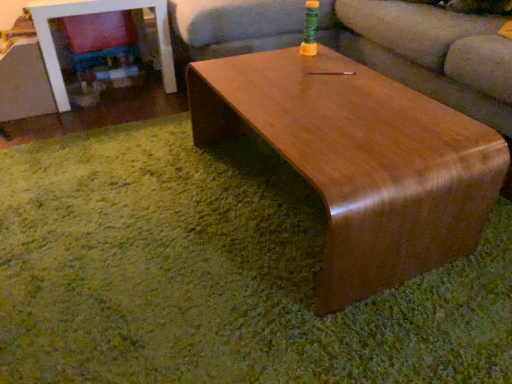
Locate an element on the screen. The width and height of the screenshot is (512, 384). shiny brown wood coffee table at center is located at coordinates (360, 161).

What are the coordinates of `glossy wood table at center` in the screenshot? It's located at 92,13.

Where is `matte brown couch at center`? This screenshot has height=384, width=512. matte brown couch at center is located at coordinates (426, 53).

Is matte brown couch at center spatially inside glossy wood table at center, or outside of it?

matte brown couch at center is spatially situated outside glossy wood table at center.

How different are the orientations of matte brown couch at center and glossy wood table at center in degrees?

The angle between the facing direction of matte brown couch at center and the facing direction of glossy wood table at center is 88.3 degrees.

Does matte brown couch at center appear on the left side of glossy wood table at center?

In fact, matte brown couch at center is to the right of glossy wood table at center.

Is point (340, 48) less distant than point (52, 70)?

No.

How many degrees apart are the facing directions of glossy wood table at center and matte brown couch at center?

There is a 88.3-degree angle between the facing directions of glossy wood table at center and matte brown couch at center.

Is glossy wood table at center touching matte brown couch at center?

No, glossy wood table at center is not making contact with matte brown couch at center.

Is glossy wood table at center completely or partially outside of matte brown couch at center?

glossy wood table at center is positioned outside matte brown couch at center.

Could you tell me if glossy wood table at center is facing matte brown couch at center?

No, glossy wood table at center is not aimed at matte brown couch at center.

Which object is positioned more to the left, glossy wood table at center or shiny brown wood coffee table at center?

From the viewer's perspective, glossy wood table at center appears more on the left side.

Is glossy wood table at center closer to the viewer compared to shiny brown wood coffee table at center?

No, it is behind shiny brown wood coffee table at center.

In the scene shown: From a real-world perspective, is glossy wood table at center physically above shiny brown wood coffee table at center?

Yes, from a real-world perspective, glossy wood table at center is over shiny brown wood coffee table at center

Is glossy wood table at center thinner than shiny brown wood coffee table at center?

In fact, glossy wood table at center might be wider than shiny brown wood coffee table at center.

Is the position of shiny brown wood coffee table at center more distant than that of glossy wood table at center?

No, shiny brown wood coffee table at center is closer to the camera.

Who is bigger, shiny brown wood coffee table at center or glossy wood table at center?

shiny brown wood coffee table at center is bigger.

Between shiny brown wood coffee table at center and glossy wood table at center, which one appears on the left side from the viewer's perspective?

glossy wood table at center.

Is matte brown couch at center surrounding shiny brown wood coffee table at center?

No, shiny brown wood coffee table at center is not inside matte brown couch at center.

From the picture: From the image's perspective, is matte brown couch at center above or below shiny brown wood coffee table at center?

matte brown couch at center is above shiny brown wood coffee table at center.

Where is `coffee table in front of the matte brown couch at center`? This screenshot has height=384, width=512. coffee table in front of the matte brown couch at center is located at coordinates (360, 161).

Who is bigger, matte brown couch at center or shiny brown wood coffee table at center?

Bigger between the two is matte brown couch at center.

Is shiny brown wood coffee table at center to the left or to the right of matte brown couch at center in the image?

In the image, shiny brown wood coffee table at center appears on the left side of matte brown couch at center.

Based on the photo, does shiny brown wood coffee table at center have a greater height compared to matte brown couch at center?

No, shiny brown wood coffee table at center is not taller than matte brown couch at center.

Is shiny brown wood coffee table at center positioned beyond the bounds of matte brown couch at center?

Yes, shiny brown wood coffee table at center is not within matte brown couch at center.

This screenshot has width=512, height=384. I want to click on table lying below the matte brown couch at center (from the image's perspective), so click(x=92, y=13).

Locate an element on the screen. Image resolution: width=512 pixels, height=384 pixels. studio couch in front of the glossy wood table at center is located at coordinates (426, 53).

Looking at the image, which one is located closer to glossy wood table at center, shiny brown wood coffee table at center or matte brown couch at center?

Based on the image, matte brown couch at center appears to be nearer to glossy wood table at center.

Estimate the real-world distances between objects in this image. Which object is closer to shiny brown wood coffee table at center, matte brown couch at center or glossy wood table at center?

The object closer to shiny brown wood coffee table at center is matte brown couch at center.

Looking at the image, which one is located further to matte brown couch at center, shiny brown wood coffee table at center or glossy wood table at center?

glossy wood table at center is further to matte brown couch at center.

Estimate the real-world distances between objects in this image. Which object is closer to glossy wood table at center, matte brown couch at center or shiny brown wood coffee table at center?

matte brown couch at center is closer to glossy wood table at center.

Which object lies further to the anchor point matte brown couch at center, glossy wood table at center or shiny brown wood coffee table at center?

Among the two, glossy wood table at center is located further to matte brown couch at center.

Based on their spatial positions, is glossy wood table at center or matte brown couch at center further from shiny brown wood coffee table at center?

glossy wood table at center.

I want to click on coffee table between glossy wood table at center and matte brown couch at center from left to right, so click(x=360, y=161).